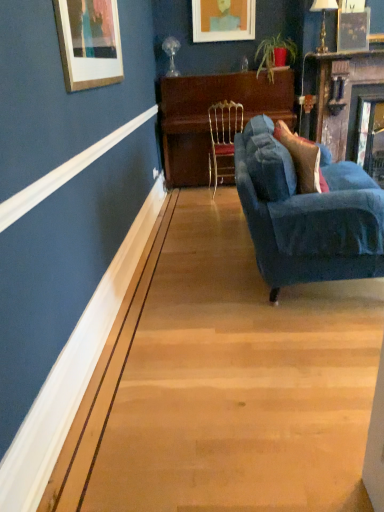
What do you see at coordinates (207, 116) in the screenshot? The height and width of the screenshot is (512, 384). I see `wooden piano at center` at bounding box center [207, 116].

The width and height of the screenshot is (384, 512). Describe the element at coordinates (223, 20) in the screenshot. I see `matte orange picture frame at upper center` at that location.

This screenshot has height=512, width=384. Identify the location of wooden mantel at upper right. (348, 106).

This screenshot has height=512, width=384. I want to click on velvet blue pillow at right, so click(x=302, y=160).

In the scene shown: From their relative heights in the image, would you say velvet blue couch at right is taller or shorter than wooden piano at center?

velvet blue couch at right is shorter than wooden piano at center.

From the image's perspective, is velvet blue couch at right positioned above or below wooden piano at center?

Clearly, from the image's perspective, velvet blue couch at right is below wooden piano at center.

Does velvet blue couch at right touch wooden piano at center?

No.

From the picture: Does velvet blue couch at right appear on the right side of wooden piano at center?

Correct, you'll find velvet blue couch at right to the right of wooden piano at center.

From the image's perspective, between wooden mantel at upper right and velvet blue couch at right, which one is located above?

wooden mantel at upper right.

Image resolution: width=384 pixels, height=512 pixels. I want to click on studio couch that is under the wooden mantel at upper right (from a real-world perspective), so click(x=307, y=214).

From the picture: Are wooden mantel at upper right and velvet blue couch at right located far from each other?

Indeed, wooden mantel at upper right is not near velvet blue couch at right.

Is velvet blue couch at right oriented away from wooden mantel at upper right?

No, velvet blue couch at right is not facing away from wooden mantel at upper right.

Is velvet blue couch at right not close to wooden mantel at upper right?

Yes, velvet blue couch at right and wooden mantel at upper right are located far from each other.

From a real-world perspective, between velvet blue couch at right and wooden mantel at upper right, who is vertically lower?

velvet blue couch at right.

From the image's perspective, between velvet blue couch at right and wooden mantel at upper right, who is located below?

velvet blue couch at right.

Considering the positions of objects velvet blue pillow at right and wooden mantel at upper right in the image provided, who is behind, velvet blue pillow at right or wooden mantel at upper right?

wooden mantel at upper right is more distant.

Is point (314, 182) positioned after point (361, 56)?

That is False.

In terms of height, does velvet blue pillow at right look taller or shorter compared to wooden mantel at upper right?

Considering their sizes, velvet blue pillow at right has less height than wooden mantel at upper right.

Which is more to the right, gold wire chair at center or velvet blue pillow at right?

Positioned to the right is velvet blue pillow at right.

Is gold wire chair at center directly adjacent to velvet blue pillow at right?

They are not placed beside each other.

From the image's perspective, which one is positioned lower, gold wire chair at center or velvet blue pillow at right?

velvet blue pillow at right.

Does point (227, 120) appear closer or farther from the camera than point (313, 153)?

Clearly, point (227, 120) is more distant from the camera than point (313, 153).

Can you confirm if gold wire chair at center is taller than matte orange picture frame at upper center?

Yes.

Considering the positions of objects gold wire chair at center and matte orange picture frame at upper center in the image provided, who is in front, gold wire chair at center or matte orange picture frame at upper center?

gold wire chair at center.

How many degrees apart are the facing directions of gold wire chair at center and matte orange picture frame at upper center?

The angular difference between gold wire chair at center and matte orange picture frame at upper center is 178 degrees.

Does gold wire chair at center touch matte orange picture frame at upper center?

They are not placed beside each other.

Is wooden mantel at upper right oriented towards gold wire chair at center?

No, wooden mantel at upper right does not turn towards gold wire chair at center.

From the picture: Can you confirm if wooden mantel at upper right is bigger than gold wire chair at center?

Indeed, wooden mantel at upper right has a larger size compared to gold wire chair at center.

Which object is closer to the camera, wooden mantel at upper right or gold wire chair at center?

wooden mantel at upper right is in front.

Is wooden mantel at upper right far away from gold wire chair at center?

No.

Where is `table above the velvet blue couch at right (from the image's perspective)`? The image size is (384, 512). table above the velvet blue couch at right (from the image's perspective) is located at coordinates (207, 116).

In order to click on studio couch that is in front of the wooden mantel at upper right in this screenshot , I will do `click(307, 214)`.

Consider the image. Estimate the real-world distances between objects in this image. Which object is closer to wooden piano at center, wooden mantel at upper right or gold wire chair at center?

The object closer to wooden piano at center is gold wire chair at center.

Considering their positions, is gold wire chair at center positioned further to matte orange picture frame at upper center than velvet blue pillow at right?

Based on the image, velvet blue pillow at right appears to be further to matte orange picture frame at upper center.

Based on their spatial positions, is velvet blue pillow at right or wooden piano at center closer to velvet blue couch at right?

Based on the image, velvet blue pillow at right appears to be nearer to velvet blue couch at right.

Based on their spatial positions, is wooden piano at center or gold wire chair at center closer to matte orange picture frame at upper center?

wooden piano at center is positioned closer to the anchor matte orange picture frame at upper center.

Based on their spatial positions, is matte orange picture frame at upper center or wooden piano at center further from wooden mantel at upper right?

matte orange picture frame at upper center is further to wooden mantel at upper right.

Based on their spatial positions, is wooden mantel at upper right or wooden piano at center further from matte orange picture frame at upper center?

Based on the image, wooden mantel at upper right appears to be further to matte orange picture frame at upper center.

From the image, which object appears to be farther from velvet blue couch at right, gold wire chair at center or matte orange picture frame at upper center?

matte orange picture frame at upper center lies further to velvet blue couch at right than the other object.

Which object lies nearer to the anchor point wooden piano at center, wooden mantel at upper right or velvet blue pillow at right?

wooden mantel at upper right is positioned closer to the anchor wooden piano at center.

The image size is (384, 512). Find the location of `pillow located between velvet blue couch at right and wooden mantel at upper right in the depth direction`. pillow located between velvet blue couch at right and wooden mantel at upper right in the depth direction is located at coordinates (302, 160).

Identify the location of fireplace between velvet blue couch at right and wooden piano at center in the front-back direction. The height and width of the screenshot is (512, 384). click(x=348, y=106).

This screenshot has width=384, height=512. Identify the location of chair located between matte orange picture frame at upper center and wooden mantel at upper right in the left-right direction. (223, 137).

Locate an element on the screen. This screenshot has width=384, height=512. table situated between gold wire chair at center and wooden mantel at upper right from left to right is located at coordinates (207, 116).